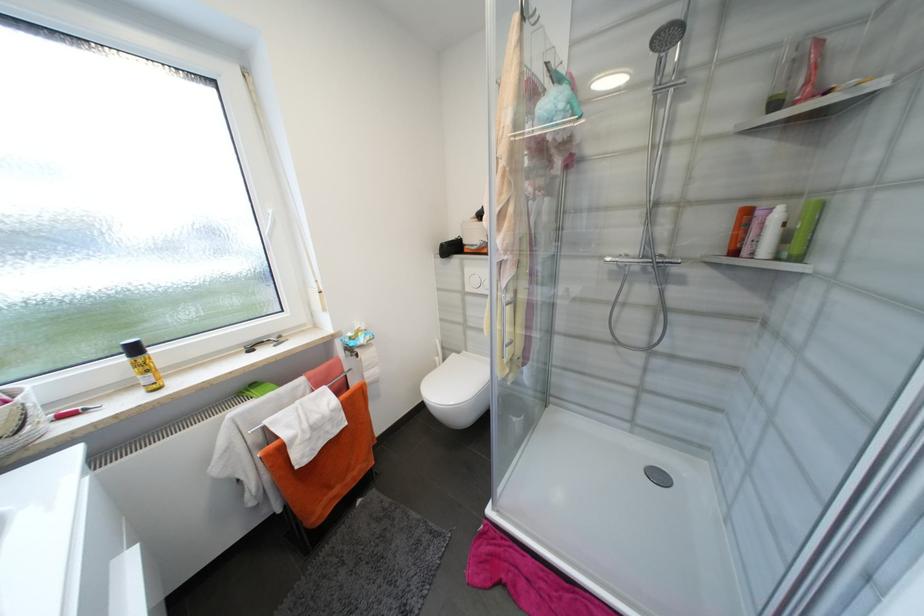
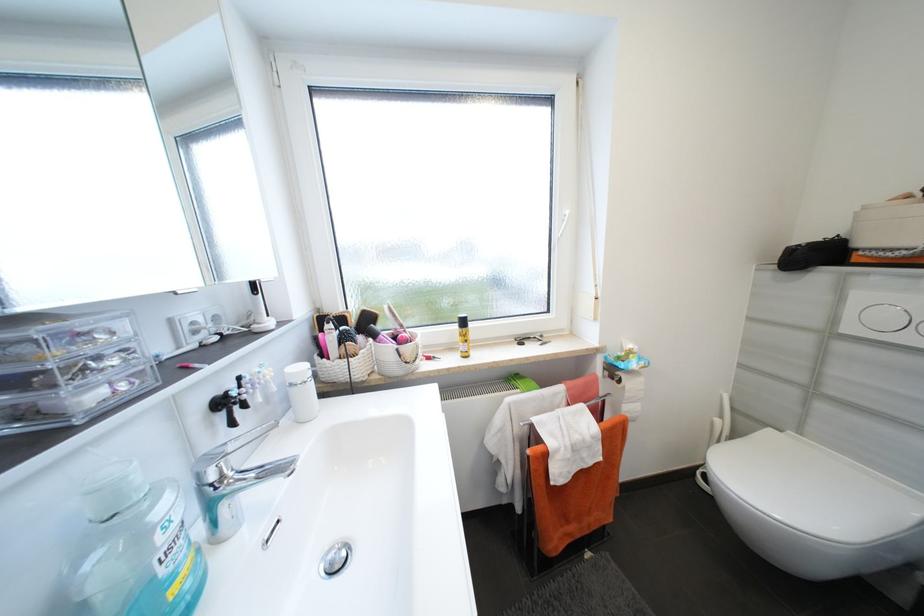
Question: The images are taken continuously from a first-person perspective. In which direction is your viewpoint rotating?

Choices:
 (A) Left
 (B) Right
 (C) Up
 (D) Down

Answer: (A)